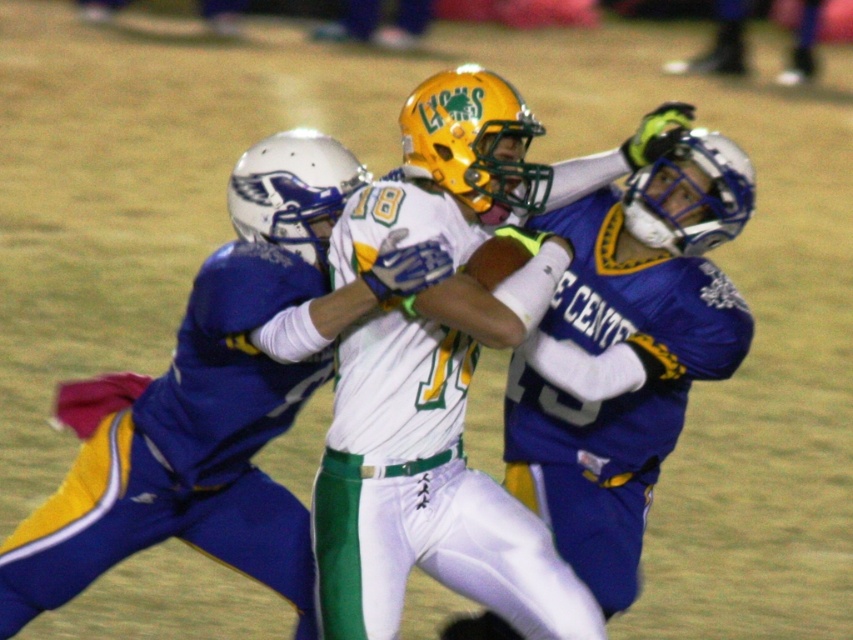
You are a sports analyst watching the game. You notice two items at the center of the field. Which item is positioned lower down between the white matte helmet at center and the blue jersey at center?

The white matte helmet at center is located below the blue jersey at center, so the white matte helmet at center is positioned lower down.

You are a sports analyst reviewing the game footage. You notice two items at the center of the field during the intense moment. Which item has a greater width between the white matte helmet at center and the blue jersey at center?

The white matte helmet at center has a greater width than the blue jersey at center.

You are a sports analyst watching the game. You notice two items at the center of the field. Which one is shorter in height between the white matte helmet at center and the blue jersey at center?

The white matte helmet at center has a lesser height compared to the blue jersey at center, so the white matte helmet at center is shorter.